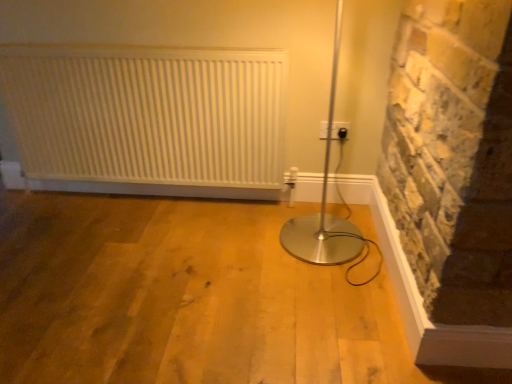
Image resolution: width=512 pixels, height=384 pixels. Describe the element at coordinates (339, 128) in the screenshot. I see `black plastic electric outlet at upper right` at that location.

Locate an element on the screen. This screenshot has width=512, height=384. black plastic electric outlet at upper right is located at coordinates (339, 128).

What do you see at coordinates (147, 114) in the screenshot?
I see `white matte radiator at upper left` at bounding box center [147, 114].

Find the location of a particular element. The width and height of the screenshot is (512, 384). white matte radiator at upper left is located at coordinates (147, 114).

This screenshot has width=512, height=384. In order to click on black plastic electric outlet at upper right in this screenshot , I will do `click(339, 128)`.

Does white matte radiator at upper left appear on the left side of black plastic electric outlet at upper right?

Correct, you'll find white matte radiator at upper left to the left of black plastic electric outlet at upper right.

Which is in front, white matte radiator at upper left or black plastic electric outlet at upper right?

white matte radiator at upper left.

Does point (283, 148) come farther from viewer compared to point (324, 127)?

Yes, point (283, 148) is farther from viewer.

From the image's perspective, which one is positioned higher, white matte radiator at upper left or black plastic electric outlet at upper right?

white matte radiator at upper left is shown above in the image.

From a real-world perspective, who is located higher, white matte radiator at upper left or black plastic electric outlet at upper right?

white matte radiator at upper left is physically above.

Is white matte radiator at upper left wider or thinner than black plastic electric outlet at upper right?

Considering their sizes, white matte radiator at upper left looks broader than black plastic electric outlet at upper right.

Can you confirm if white matte radiator at upper left is shorter than black plastic electric outlet at upper right?

No.

Considering the sizes of objects white matte radiator at upper left and black plastic electric outlet at upper right in the image provided, who is smaller, white matte radiator at upper left or black plastic electric outlet at upper right?

With smaller size is black plastic electric outlet at upper right.

Consider the image. Is black plastic electric outlet at upper right completely or partially inside white matte radiator at upper left?

No.

From the picture: Is the surface of white matte radiator at upper left in direct contact with black plastic electric outlet at upper right?

They are not placed beside each other.

Could you tell me if white matte radiator at upper left is facing black plastic electric outlet at upper right?

No, white matte radiator at upper left is not facing towards black plastic electric outlet at upper right.

In order to click on radiator above the black plastic electric outlet at upper right (from a real-world perspective) in this screenshot , I will do `click(147, 114)`.

Is black plastic electric outlet at upper right at the right side of white matte radiator at upper left?

Yes.

From the picture: Is black plastic electric outlet at upper right further to the viewer compared to white matte radiator at upper left?

Yes, black plastic electric outlet at upper right is behind white matte radiator at upper left.

Between point (346, 132) and point (102, 147), which one is positioned in front?

The point (346, 132) is more forward.

From the image's perspective, does black plastic electric outlet at upper right appear lower than white matte radiator at upper left?

Yes, from the image's perspective, black plastic electric outlet at upper right is beneath white matte radiator at upper left.

From a real-world perspective, between black plastic electric outlet at upper right and white matte radiator at upper left, who is vertically lower?

black plastic electric outlet at upper right.

Which of these two, black plastic electric outlet at upper right or white matte radiator at upper left, is thinner?

Thinner between the two is black plastic electric outlet at upper right.

Considering the sizes of objects black plastic electric outlet at upper right and white matte radiator at upper left in the image provided, who is shorter, black plastic electric outlet at upper right or white matte radiator at upper left?

black plastic electric outlet at upper right.

Which of these two, black plastic electric outlet at upper right or white matte radiator at upper left, is bigger?

With larger size is white matte radiator at upper left.

Would you say black plastic electric outlet at upper right is outside white matte radiator at upper left?

Yes, black plastic electric outlet at upper right is outside of white matte radiator at upper left.

Is black plastic electric outlet at upper right directly adjacent to white matte radiator at upper left?

No, black plastic electric outlet at upper right is not touching white matte radiator at upper left.

Is black plastic electric outlet at upper right oriented away from white matte radiator at upper left?

black plastic electric outlet at upper right is not turned away from white matte radiator at upper left.

At what (x,y) coordinates should I click in order to perform the action: click on radiator that appears above the black plastic electric outlet at upper right (from the image's perspective). Please return your answer as a coordinate pair (x, y). Looking at the image, I should click on (147, 114).

Find the location of a particular element. radiator lying in front of the black plastic electric outlet at upper right is located at coordinates (147, 114).

Where is `electric outlet below the white matte radiator at upper left (from the image's perspective)`? electric outlet below the white matte radiator at upper left (from the image's perspective) is located at coordinates (339, 128).